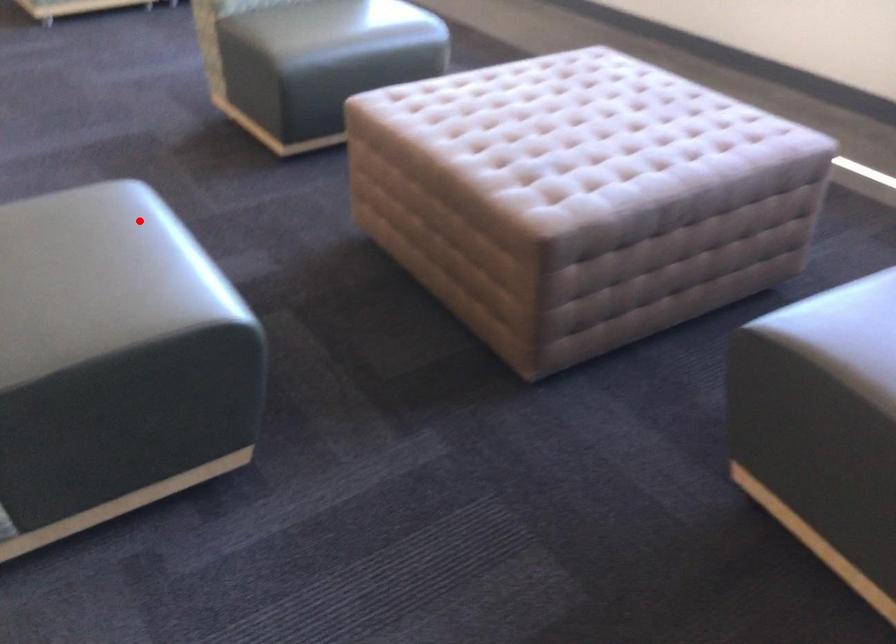
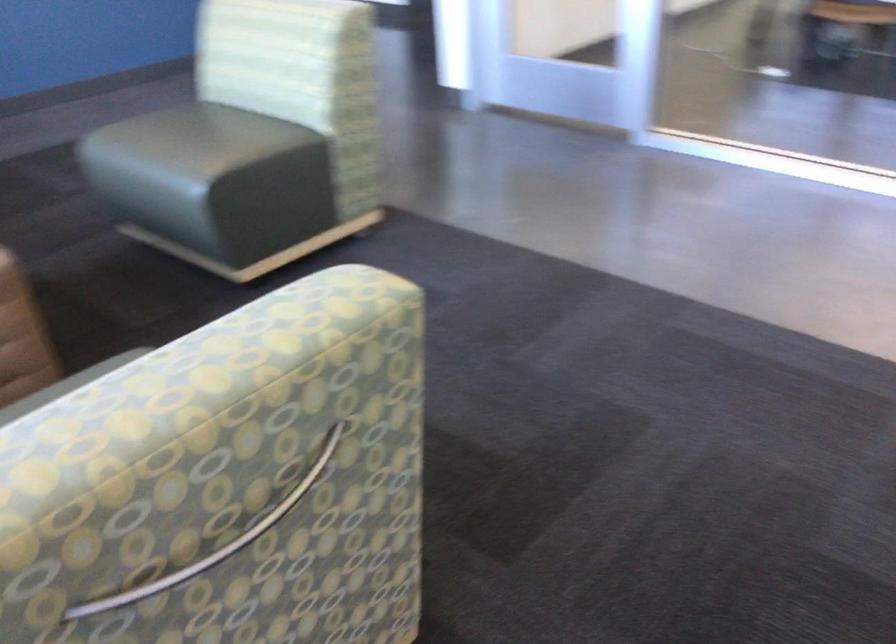
In the second image, find the point that corresponds to the highlighted location in the first image.

(192, 143)